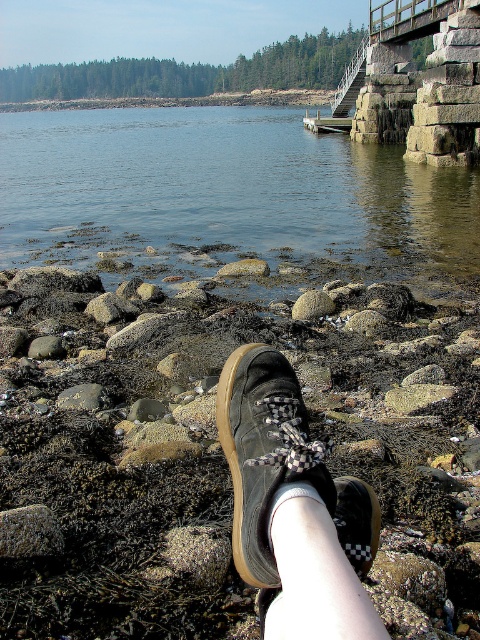
You are standing on the rocky shoreline and notice the rusty stone at lower center and the black checkered shoe at lower center. Which object is closer to you?

The rusty stone at lower center is closer to you because it is further to the viewer than the black checkered shoe at lower center.

You are standing on the rocky shoreline and notice your two shoes. Which shoe is closer to the water? Please choose between the matte black shoe at lower center and the black checkered shoe at lower center.

The matte black shoe at lower center is closer to the water because it is positioned over the black checkered shoe at lower center, indicating it is in front.